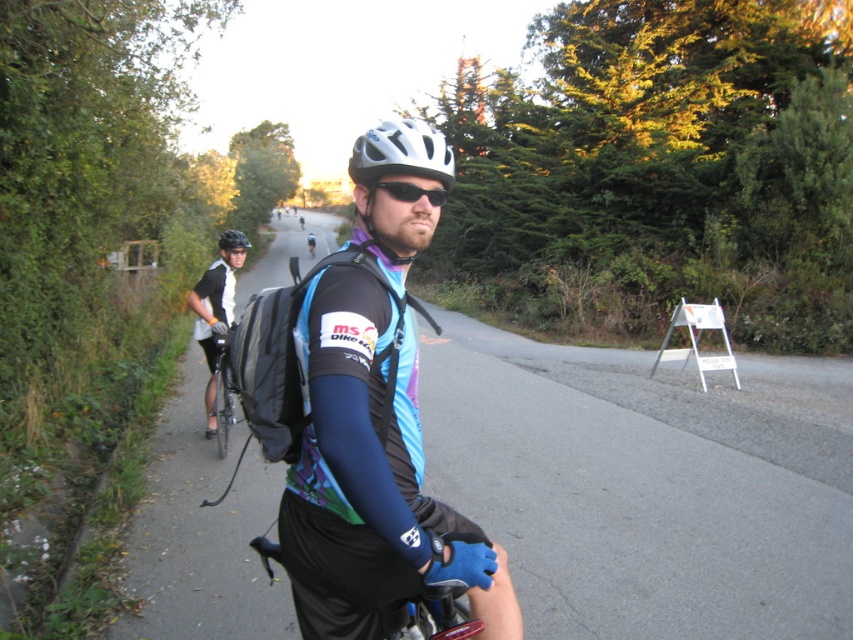
Does shiny black bicycle at center have a greater width compared to black matte sunglasses at center?

Indeed, shiny black bicycle at center has a greater width compared to black matte sunglasses at center.

Who is more distant from viewer, (221,372) or (440,204)?

Positioned behind is point (221,372).

Is point (219, 456) behind point (410, 188)?

Yes, it is.

Locate an element on the screen. The height and width of the screenshot is (640, 853). shiny black bicycle at center is located at coordinates (222, 396).

Does matte black cycling jersey at center have a lesser height compared to shiny black bicycle at center?

No.

What do you see at coordinates (370, 480) in the screenshot?
I see `matte black cycling jersey at center` at bounding box center [370, 480].

Locate an element on the screen. This screenshot has width=853, height=640. matte black cycling jersey at center is located at coordinates (370, 480).

Between matte black cycling jersey at center and black matte cycling jersey at center, which one is positioned higher?

black matte cycling jersey at center is above.

The image size is (853, 640). In order to click on matte black cycling jersey at center in this screenshot , I will do `click(370, 480)`.

Image resolution: width=853 pixels, height=640 pixels. Find the location of `matte black cycling jersey at center`. matte black cycling jersey at center is located at coordinates (370, 480).